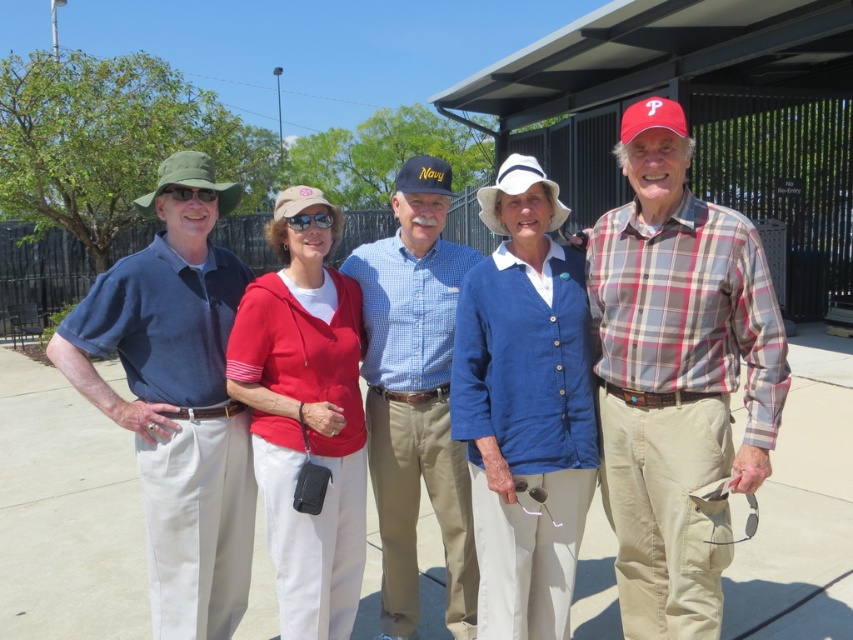
Question: Is plaid cotton shirt at right smaller than green fabric hat at left?

Choices:
 (A) no
 (B) yes

Answer: (A)

Question: Among these objects, which one is farthest from the camera?

Choices:
 (A) pink fabric baseball cap at center
 (B) plaid cotton shirt at right
 (C) blue linen cardigan at center
 (D) matte blue shirt at center

Answer: (A)

Question: Is the position of green fabric hat at left more distant than that of pink fabric baseball cap at center?

Choices:
 (A) yes
 (B) no

Answer: (B)

Question: Which of these objects is positioned farthest from the green fabric hat at left?

Choices:
 (A) blue checkered shirt at center
 (B) blue linen cardigan at center
 (C) plaid cotton shirt at right
 (D) matte blue shirt at left

Answer: (C)

Question: Which point appears farthest from the camera in this image?

Choices:
 (A) (396, 177)
 (B) (509, 195)
 (C) (366, 282)
 (D) (183, 166)

Answer: (A)

Question: Does blue checkered shirt at center have a greater width compared to navy fabric baseball cap at center?

Choices:
 (A) yes
 (B) no

Answer: (A)